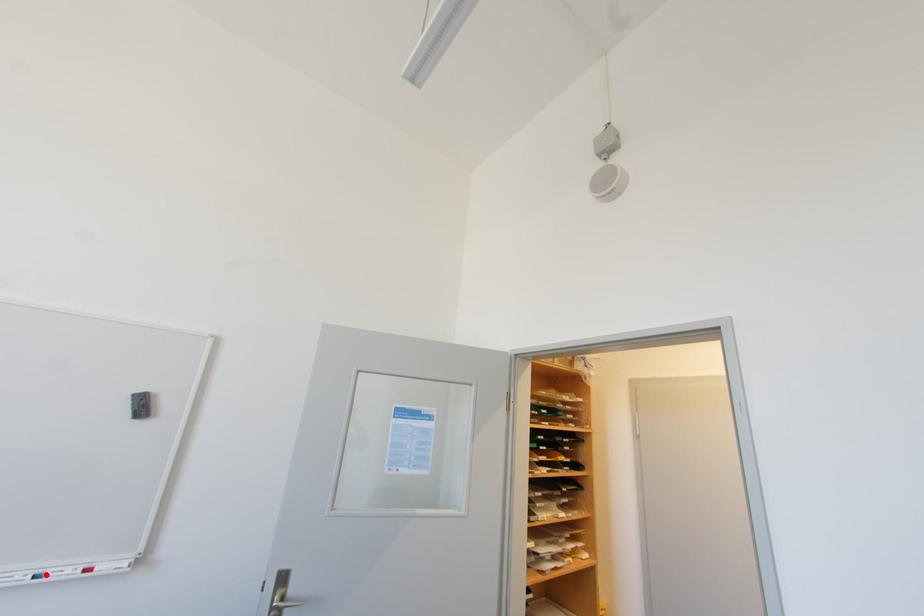
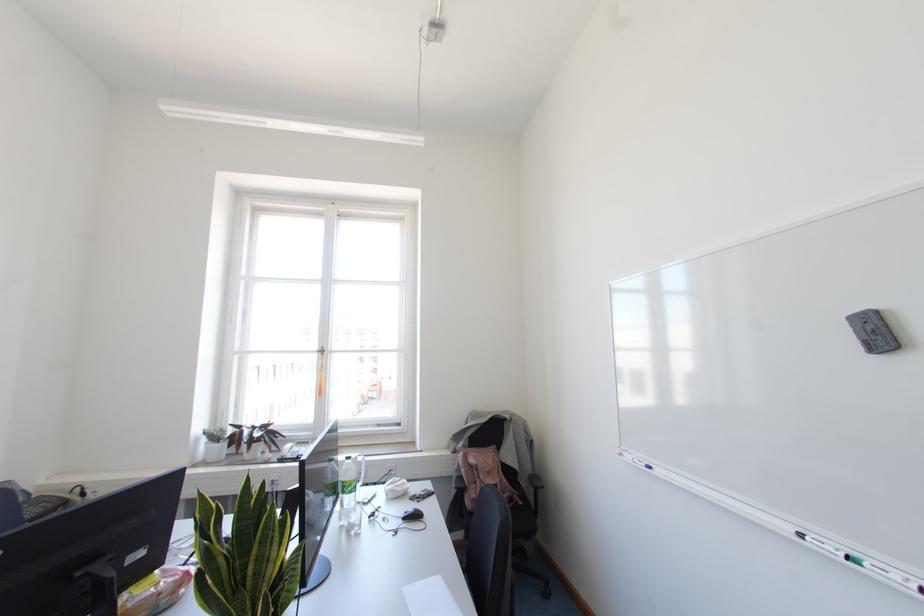
In the second image, find the point that corresponds to the highlighted location in the first image.

(866, 565)